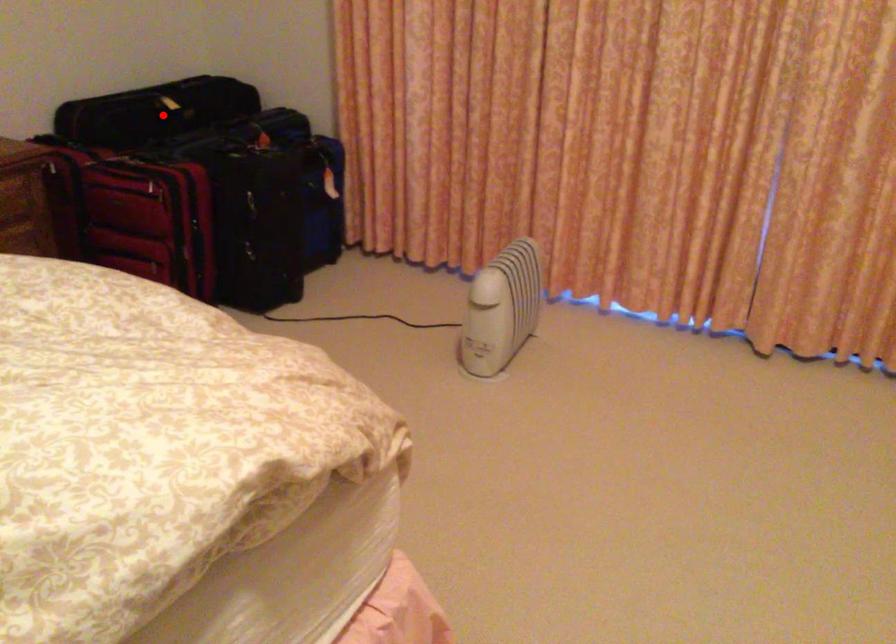
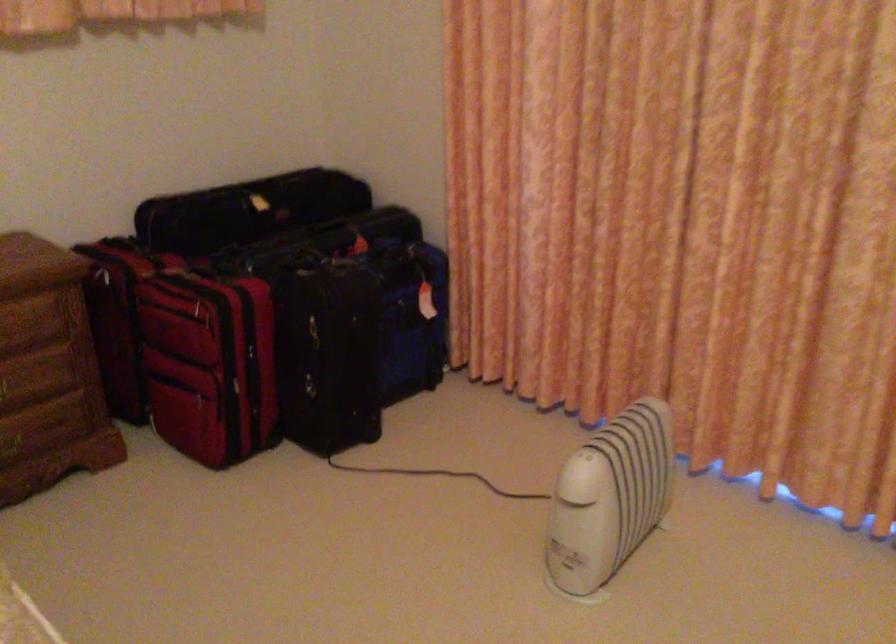
Find the pixel in the second image that matches the highlighted location in the first image.

(247, 210)